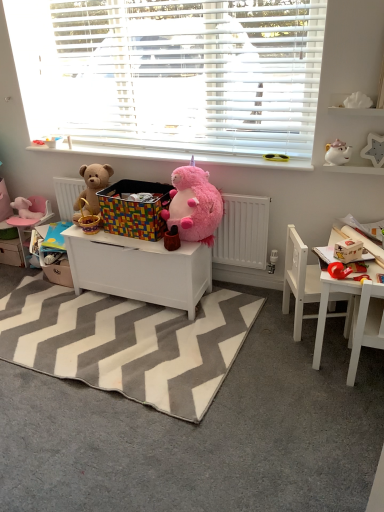
What are the coordinates of `shiny yellow sunglasses at upper center, the 2th toy when ordered from back to front` in the screenshot? It's located at (276, 157).

Image resolution: width=384 pixels, height=512 pixels. I want to click on white plastic blinds at upper center, so click(171, 76).

What do you see at coordinates (171, 76) in the screenshot? The width and height of the screenshot is (384, 512). I see `white plastic blinds at upper center` at bounding box center [171, 76].

The image size is (384, 512). I want to click on white paper towel at upper right, which appears as the 2th toy when viewed from the front, so click(357, 101).

How different are the orientations of white plastic chair at right, the 2th chair from the back, and multicolored plastic crate at center in degrees?

white plastic chair at right, the 2th chair from the back, and multicolored plastic crate at center are facing 174 degrees away from each other.

Looking at this image, from the image's perspective, which one is positioned lower, white plastic chair at right, the 2th chair from the back, or multicolored plastic crate at center?

white plastic chair at right, the 2th chair from the back, is shown below in the image.

Is white plastic chair at right, arranged as the first chair when viewed from the front, to the left of multicolored plastic crate at center from the viewer's perspective?

No, white plastic chair at right, arranged as the first chair when viewed from the front, is not to the left of multicolored plastic crate at center.

Is white plastic chair at right, the 2th chair from the back, a part of shiny yellow sunglasses at upper center, the 2th toy when ordered from back to front?

No, white plastic chair at right, the 2th chair from the back, is not a part of shiny yellow sunglasses at upper center, the 2th toy when ordered from back to front.

Is shiny yellow sunglasses at upper center, marked as the 4th toy in a right-to-left arrangement, next to white plastic chair at right, arranged as the first chair when viewed from the front, and touching it?

shiny yellow sunglasses at upper center, marked as the 4th toy in a right-to-left arrangement, is not next to white plastic chair at right, arranged as the first chair when viewed from the front, and they're not touching.

Considering the positions of objects shiny yellow sunglasses at upper center, which is the 2th toy from left to right, and white plastic chair at right, arranged as the first chair when viewed from the front, in the image provided, who is behind, shiny yellow sunglasses at upper center, which is the 2th toy from left to right, or white plastic chair at right, arranged as the first chair when viewed from the front,?

shiny yellow sunglasses at upper center, which is the 2th toy from left to right.

What's the angular difference between multicolored plastic crate at center and white matte star at upper right, marked as the 1th toy in a front-to-back arrangement,'s facing directions?

The angular difference between multicolored plastic crate at center and white matte star at upper right, marked as the 1th toy in a front-to-back arrangement, is 2.89 degrees.

Considering the sizes of objects multicolored plastic crate at center and white matte star at upper right, marked as the 1th toy in a front-to-back arrangement, in the image provided, who is taller, multicolored plastic crate at center or white matte star at upper right, marked as the 1th toy in a front-to-back arrangement,?

With more height is multicolored plastic crate at center.

Where is `crate behind the white matte star at upper right, which is the fifth toy from back to front`? This screenshot has width=384, height=512. crate behind the white matte star at upper right, which is the fifth toy from back to front is located at coordinates (x=134, y=209).

Is multicolored plastic crate at center placed right next to white matte star at upper right, marked as the 1th toy in a front-to-back arrangement?

multicolored plastic crate at center and white matte star at upper right, marked as the 1th toy in a front-to-back arrangement, are clearly separated.

Identify the location of crate positioned vertically above the white plastic radiator at center (from a real-world perspective). The image size is (384, 512). (134, 209).

Does point (115, 233) come closer to viewer compared to point (235, 234)?

Yes, point (115, 233) is in front of point (235, 234).

From a real-world perspective, who is located lower, multicolored plastic crate at center or white plastic radiator at center?

white plastic radiator at center is physically lower.

Can we say multicolored plastic crate at center lies outside white plastic radiator at center?

Yes, multicolored plastic crate at center is outside of white plastic radiator at center.

Which is behind, white matte toy chest at center, placed as the 1th table when sorted from left to right, or gray zigzag rug at center?

white matte toy chest at center, placed as the 1th table when sorted from left to right, is behind.

Is point (117, 253) farther from camera compared to point (220, 346)?

Yes, it is behind point (220, 346).

Considering the sizes of objects white matte toy chest at center, placed as the 1th table when sorted from left to right, and gray zigzag rug at center in the image provided, who is shorter, white matte toy chest at center, placed as the 1th table when sorted from left to right, or gray zigzag rug at center?

gray zigzag rug at center.

From the image's perspective, which one is positioned higher, white matte toy chest at center, placed as the 1th table when sorted from left to right, or gray zigzag rug at center?

white matte toy chest at center, placed as the 1th table when sorted from left to right, appears higher in the image.

Could you tell me if multicolored plastic crate at center is facing white glossy teapot at upper right, the third toy viewed from the front?

No, multicolored plastic crate at center is not aimed at white glossy teapot at upper right, the third toy viewed from the front.

Can you confirm if multicolored plastic crate at center is taller than white glossy teapot at upper right, the third toy viewed from the front?

Correct, multicolored plastic crate at center is much taller as white glossy teapot at upper right, the third toy viewed from the front.

From the image's perspective, would you say multicolored plastic crate at center is positioned over white glossy teapot at upper right, the third toy viewed from the front?

No.

Could you measure the distance between multicolored plastic crate at center and white glossy teapot at upper right, acting as the 3th toy starting from the left?

1.02 meters.

From the image's perspective, does white plastic chair at right, arranged as the first chair when viewed from the front, appear lower than pink plush toy at left, positioned as the 5th toy in front-to-back order?

Yes, from the image's perspective, white plastic chair at right, arranged as the first chair when viewed from the front, is beneath pink plush toy at left, positioned as the 5th toy in front-to-back order.

From their relative heights in the image, would you say white plastic chair at right, arranged as the first chair when viewed from the front, is taller or shorter than pink plush toy at left, marked as the 1th toy in a back-to-front arrangement?

In the image, white plastic chair at right, arranged as the first chair when viewed from the front, appears to be taller than pink plush toy at left, marked as the 1th toy in a back-to-front arrangement.

Looking at this image, does white plastic chair at right, arranged as the first chair when viewed from the front, have a larger size compared to pink plush toy at left, acting as the 5th toy starting from the right?

Yes, white plastic chair at right, arranged as the first chair when viewed from the front, is bigger than pink plush toy at left, acting as the 5th toy starting from the right.

What's the angular difference between white plastic chair at right, arranged as the first chair when viewed from the front, and pink plush toy at left, marked as the 1th toy in a back-to-front arrangement,'s facing directions?

The facing directions of white plastic chair at right, arranged as the first chair when viewed from the front, and pink plush toy at left, marked as the 1th toy in a back-to-front arrangement, are 178 degrees apart.

What are the coordinates of `crate that appears above the white plastic chair at right, the 2th chair from the back (from the image's perspective)` in the screenshot? It's located at (134, 209).

The height and width of the screenshot is (512, 384). Identify the location of toy that is the 4th one when counting backward from the white plastic chair at right, arranged as the first chair when viewed from the front. (276, 157).

From the image, which object appears to be nearer to white glossy table at right, which is the 2th table in left-to-right order, white paper towel at upper right, which is the second toy from right to left, or white matte star at upper right, which is the fifth toy from back to front?

The object closer to white glossy table at right, which is the 2th table in left-to-right order, is white matte star at upper right, which is the fifth toy from back to front.

When comparing their distances from white matte toy chest at center, which is the 2th table from right to left, does white wooden chair at lower right, the second chair when ordered from front to back, or brushed metal drawer at lower left seem further?

brushed metal drawer at lower left lies further to white matte toy chest at center, which is the 2th table from right to left, than the other object.

Based on their spatial positions, is soft brown teddy bear at left, which appears as the first teddy bear when viewed from the left, or gray zigzag rug at center further from matte white storage box at right?

Based on the image, soft brown teddy bear at left, which appears as the first teddy bear when viewed from the left, appears to be further to matte white storage box at right.

Based on their spatial positions, is white glossy teapot at upper right, acting as the 3th toy starting from the left, or white paper towel at upper right, acting as the fourth toy starting from the left, closer to matte white storage box at right?

white glossy teapot at upper right, acting as the 3th toy starting from the left, is closer to matte white storage box at right.

Estimate the real-world distances between objects in this image. Which object is further from gray zigzag rug at center, multicolored plastic crate at center or white plastic sunglasses at upper center?

white plastic sunglasses at upper center is positioned further to the anchor gray zigzag rug at center.

From the picture: Estimate the real-world distances between objects in this image. Which object is closer to white matte star at upper right, which is the fifth toy from back to front, gray zigzag rug at center or white glossy teapot at upper right, the third toy viewed from the front?

white glossy teapot at upper right, the third toy viewed from the front, is positioned closer to the anchor white matte star at upper right, which is the fifth toy from back to front.

Estimate the real-world distances between objects in this image. Which object is further from fluffy pink plush at center, which is the 1th teddy bear in right-to-left order, white glossy table at right, positioned as the 1th table in right-to-left order, or white paper towel at upper right, which is the second toy from right to left?

white paper towel at upper right, which is the second toy from right to left.

Which object lies further to the anchor point gray zigzag rug at center, shiny yellow sunglasses at upper center, the 4th toy viewed from the front, or white plastic radiator at center?

shiny yellow sunglasses at upper center, the 4th toy viewed from the front, is positioned further to the anchor gray zigzag rug at center.

Find the location of a particular element. This screenshot has width=384, height=512. table between brushed metal drawer at lower left and matte white storage box at right in the horizontal direction is located at coordinates (140, 269).

The height and width of the screenshot is (512, 384). What are the coordinates of `teddy bear located between white matte toy chest at center, which is the 2th table from right to left, and white paper towel at upper right, which appears as the 2th toy when viewed from the front, in the left-right direction` in the screenshot? It's located at (194, 205).

The height and width of the screenshot is (512, 384). Find the location of `chair between white paper towel at upper right, which is the second toy from right to left, and white glossy table at right, which is the 2th table in left-to-right order, in the up-down direction`. chair between white paper towel at upper right, which is the second toy from right to left, and white glossy table at right, which is the 2th table in left-to-right order, in the up-down direction is located at coordinates (299, 280).

The image size is (384, 512). In order to click on mat between brushed metal drawer at lower left and white paper towel at upper right, which is the 4th toy in back-to-front order in this screenshot , I will do `click(127, 342)`.